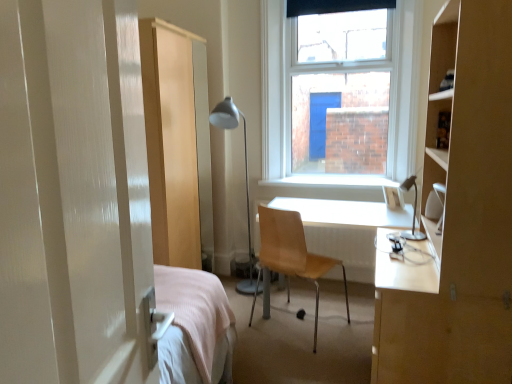
You are a GUI agent. You are given a task and a screenshot of the screen. Output one action in this format:
    pyautogui.click(x=<x>, y=<y>)
    Task: Click on the free point below matte silver floor lamp at center, which appears as the first table lamp when viewed from the left (from a real-world perspective)
    Image resolution: width=512 pixels, height=384 pixels.
    Given the screenshot: What is the action you would take?
    pyautogui.click(x=242, y=303)